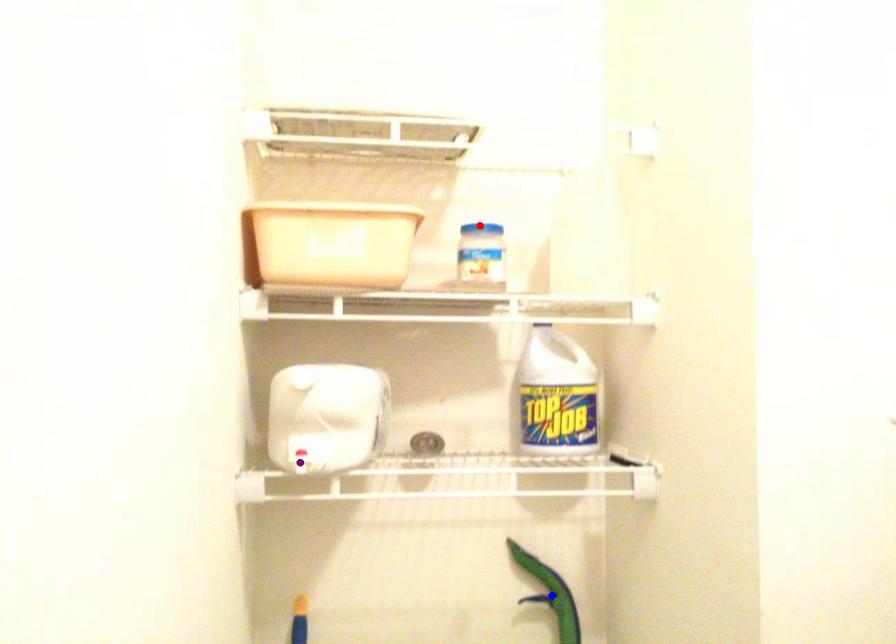
Order these from nearest to farthest:
blue point | purple point | red point

purple point
red point
blue point